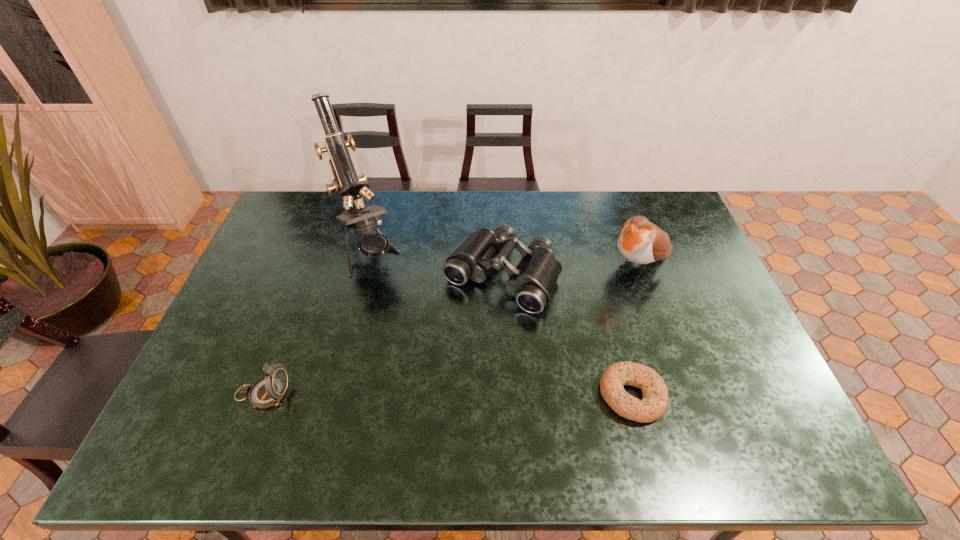
The height and width of the screenshot is (540, 960). Find the location of `empty space between the compass and the bagel`. empty space between the compass and the bagel is located at coordinates pyautogui.click(x=447, y=395).

Identify the location of vacant area that lies between the third object from left to right and the compass. (382, 335).

The height and width of the screenshot is (540, 960). In order to click on free space between the second tallest object and the shortest object in this screenshot , I will do `click(636, 330)`.

Find the location of a particular element. The image size is (960, 540). free space between the bagel and the third object from right to left is located at coordinates (566, 335).

This screenshot has width=960, height=540. I want to click on vacant region between the bagel and the third object from left to right, so click(566, 335).

You are a GUI agent. You are given a task and a screenshot of the screen. Output one action in this format:
    pyautogui.click(x=<x>, y=<y>)
    Task: Click on the unoccupied position between the second tallest object and the shortest object
    Image resolution: width=960 pixels, height=540 pixels.
    Given the screenshot: What is the action you would take?
    pyautogui.click(x=636, y=330)

Identify which object is the third closest to the bird. Please provide its 2D coordinates. Your answer should be formatted as a tuple, i.e. [(x, y)], where the tuple contains the x and y coordinates of a point satisfying the conditions above.

[(349, 185)]

Locate an element on the screen. object that is the third closest to the bird is located at coordinates (349, 185).

Where is `free region that satisfies the following two spatial constraints: 1. on the front side of the binoculars; 2. on the right side of the microscope`? free region that satisfies the following two spatial constraints: 1. on the front side of the binoculars; 2. on the right side of the microscope is located at coordinates (360, 276).

This screenshot has width=960, height=540. I want to click on free space that satisfies the following two spatial constraints: 1. on the back side of the bagel; 2. on the right side of the bird, so click(598, 265).